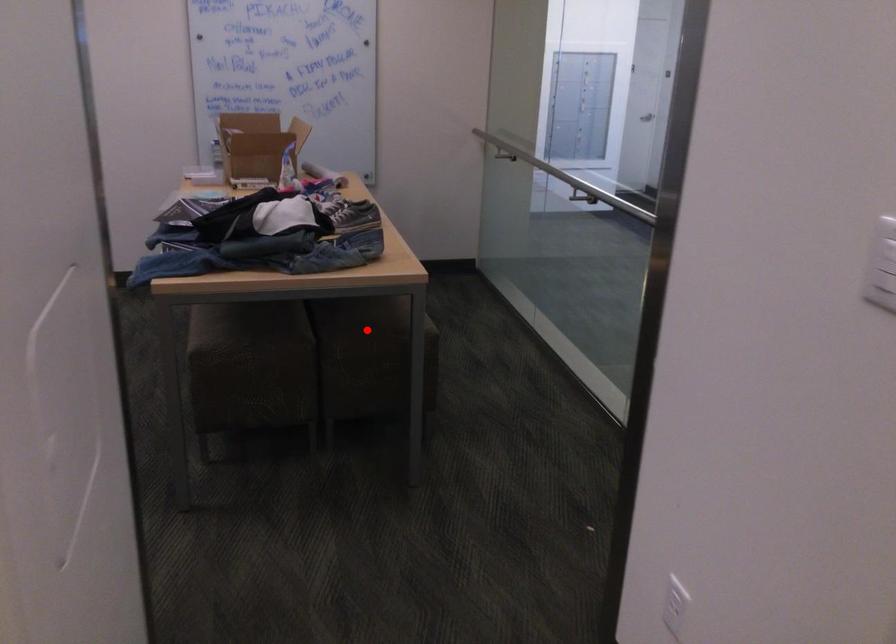
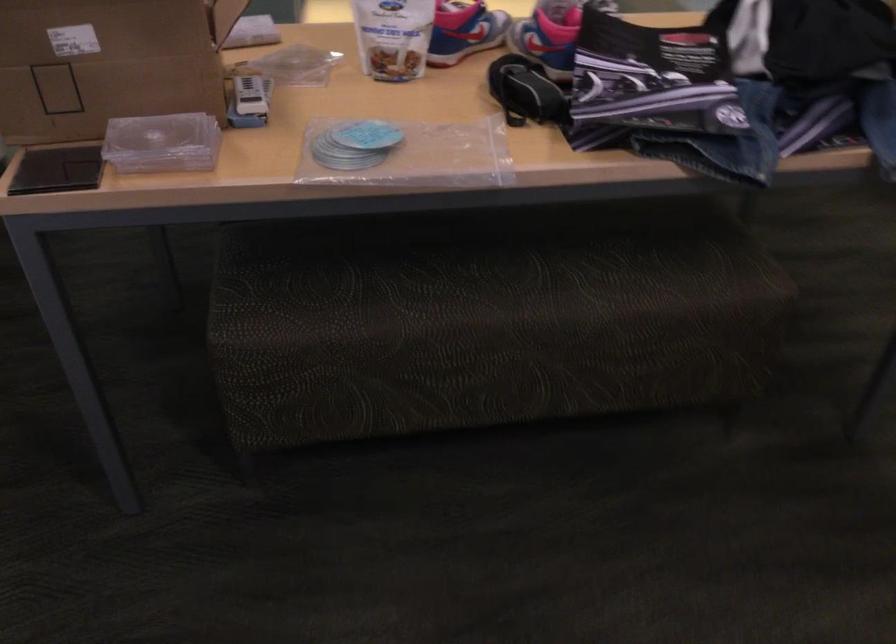
Question: I am providing you with two images of the same scene from different viewpoints. A red point is marked on the first image. At the location where the point appears in image 1, is it still visible in image 2?

Choices:
 (A) Yes
 (B) No

Answer: (B)